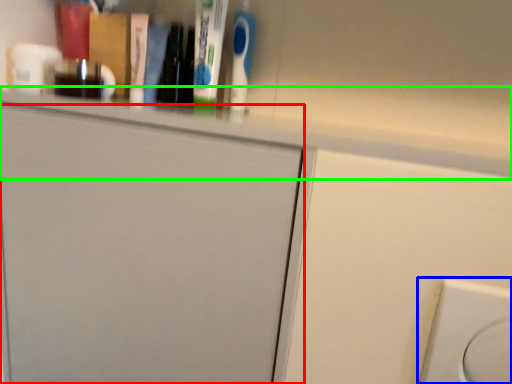
Question: Which is nearer to the door (highlighted by a red box)? electric outlet (highlighted by a blue box) or ledge (highlighted by a green box).

Choices:
 (A) electric outlet
 (B) ledge

Answer: (B)